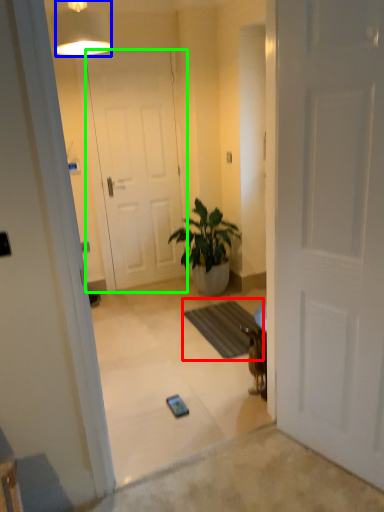
Question: Based on their relative distances, which object is nearer to doormat (highlighted by a red box)? Choose from lamp (highlighted by a blue box) and door (highlighted by a green box).

Choices:
 (A) lamp
 (B) door

Answer: (B)